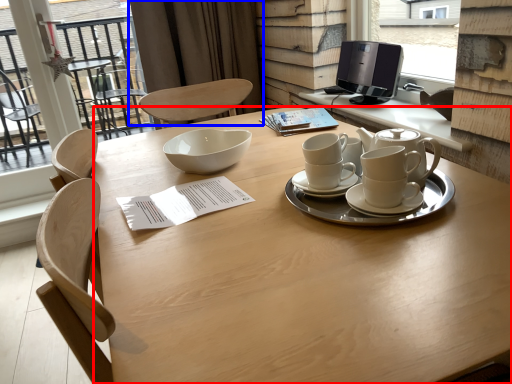
Question: Which of the following is the closest to the observer, desk (highlighted by a red box) or curtain (highlighted by a blue box)?

Choices:
 (A) desk
 (B) curtain

Answer: (A)